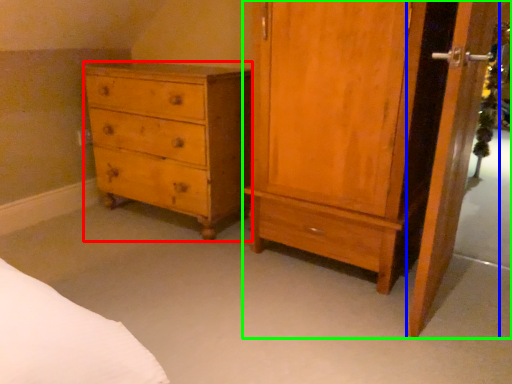
Question: Estimate the real-world distances between objects in this image. Which object is closer to chest of drawers (highlighted by a red box), screen door (highlighted by a blue box) or nightstand (highlighted by a green box)?

Choices:
 (A) screen door
 (B) nightstand

Answer: (B)